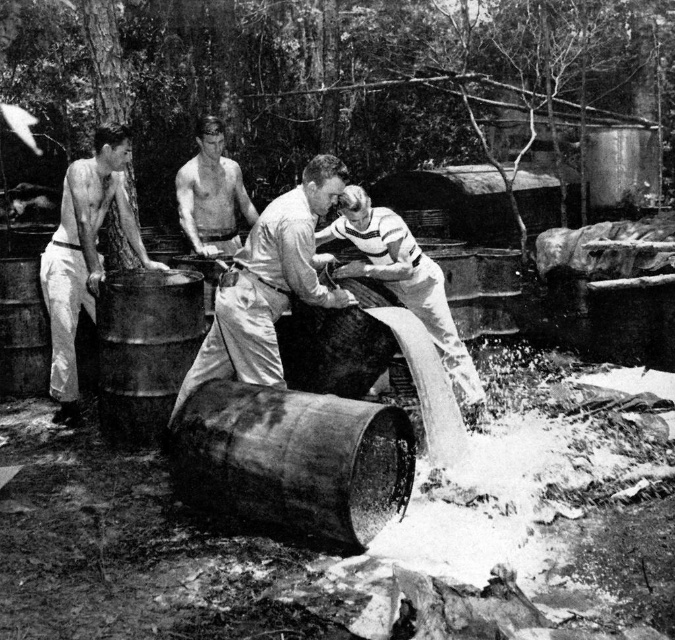
You are observing the scene from a distance and want to know which clothing item is nearer to you between the smooth white shirt at center and the smooth leather jacket at center. Can you tell me which one is closer?

The smooth white shirt at center is closer to the viewer than the smooth leather jacket at center.

Based on the scene description, where is the smooth white shirt at center located in the image?

The smooth white shirt at center is located at the 2D coordinates point (270, 284) in the image.